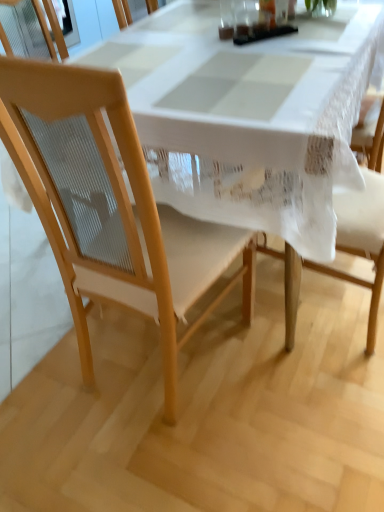
Identify the location of free space below light wood chair at center (from a real-world perspective). Image resolution: width=384 pixels, height=512 pixels. (153, 365).